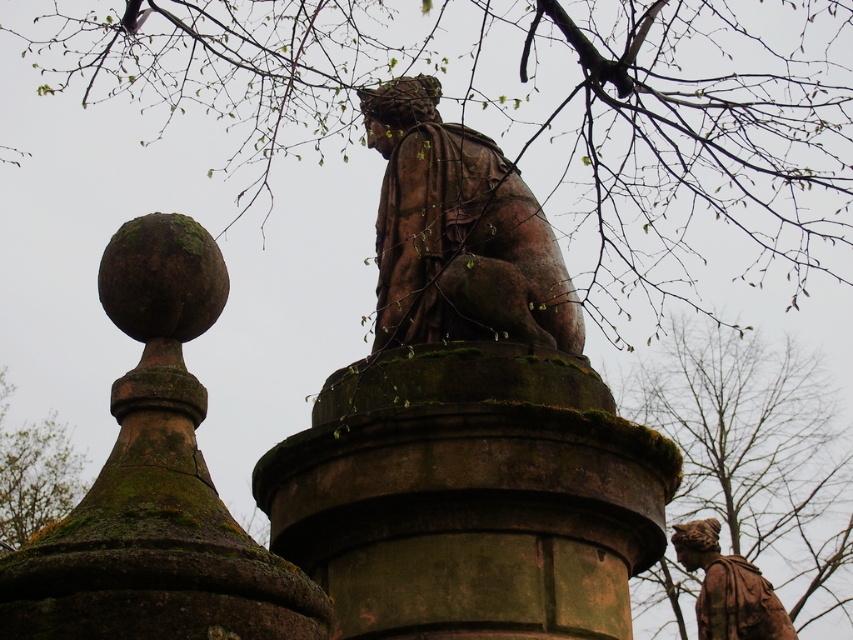
Based on the photo, between green mossy tree at upper center and green mossy tree at lower right, which one appears on the right side from the viewer's perspective?

green mossy tree at lower right is more to the right.

Measure the distance between green mossy tree at upper center and camera.

63.78 meters

This screenshot has width=853, height=640. Find the location of `green mossy tree at upper center`. green mossy tree at upper center is located at coordinates (525, 108).

Is green mossy tree at lower right wider than rustic stone statue at center?

Yes, green mossy tree at lower right is wider than rustic stone statue at center.

Who is shorter, green mossy tree at lower right or rustic stone statue at center?

rustic stone statue at center

You are a GUI agent. You are given a task and a screenshot of the screen. Output one action in this format:
    pyautogui.click(x=<x>, y=<y>)
    Task: Click on the green mossy tree at lower right
    
    Given the screenshot: What is the action you would take?
    755,452

Where is `green mossy tree at lower right`? This screenshot has height=640, width=853. green mossy tree at lower right is located at coordinates (755, 452).

Who is taller, rustic stone statue at center or green mossy stone at upper left?

Standing taller between the two is green mossy stone at upper left.

Who is shorter, rustic stone statue at center or green mossy stone at upper left?

rustic stone statue at center

I want to click on rustic stone statue at center, so click(x=457, y=234).

In order to click on rustic stone statue at center in this screenshot , I will do `click(457, 234)`.